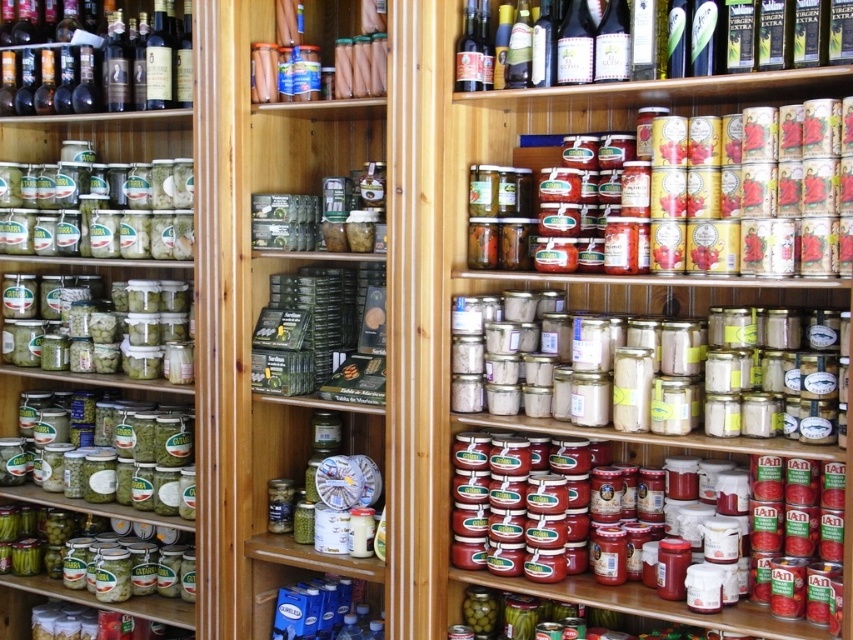
Question: Is the position of matte glass jars at upper center less distant than that of green glass bottle at upper center?

Choices:
 (A) no
 (B) yes

Answer: (A)

Question: Which point is farther from the camera taking this photo?

Choices:
 (A) (51, 464)
 (B) (764, 218)

Answer: (A)

Question: Can you confirm if shiny metallic cans at upper right is bigger than white matte jars at center?

Choices:
 (A) yes
 (B) no

Answer: (B)

Question: Is green matte jars at left positioned before shiny metallic cans at upper right?

Choices:
 (A) no
 (B) yes

Answer: (A)

Question: Which object is the farthest from the shiny dark glass bottles at upper left?

Choices:
 (A) shiny metallic cans at upper right
 (B) green matte jars at center

Answer: (A)

Question: Which point is farther to the camera?

Choices:
 (A) green matte jars at left
 (B) matte glass jars at upper center
 (C) green glass bottle at upper center

Answer: (A)